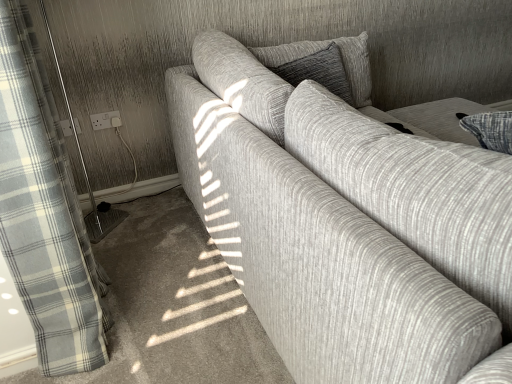
Question: Is textured gray couch at center thinner than white plastic socket at upper left, which appears as the first electric outlet when viewed from the right?

Choices:
 (A) no
 (B) yes

Answer: (A)

Question: Would you consider textured gray couch at center to be distant from white plastic socket at upper left, which appears as the first electric outlet when viewed from the right?

Choices:
 (A) no
 (B) yes

Answer: (B)

Question: Is textured gray couch at center wider than white plastic socket at upper left, which appears as the first electric outlet when viewed from the right?

Choices:
 (A) no
 (B) yes

Answer: (B)

Question: Can you confirm if textured gray couch at center is smaller than white plastic socket at upper left, acting as the second electric outlet starting from the left?

Choices:
 (A) no
 (B) yes

Answer: (A)

Question: From a real-world perspective, is textured gray couch at center located beneath white plastic socket at upper left, acting as the second electric outlet starting from the left?

Choices:
 (A) yes
 (B) no

Answer: (A)

Question: Considering the relative positions of textured gray couch at center and white plastic socket at upper left, acting as the second electric outlet starting from the left, in the image provided, is textured gray couch at center to the right of white plastic socket at upper left, acting as the second electric outlet starting from the left, from the viewer's perspective?

Choices:
 (A) no
 (B) yes

Answer: (B)

Question: From a real-world perspective, is textured gray couch at center positioned over white textured screen door at left based on gravity?

Choices:
 (A) no
 (B) yes

Answer: (A)

Question: Can you confirm if textured gray couch at center is bigger than white textured screen door at left?

Choices:
 (A) yes
 (B) no

Answer: (A)

Question: Is textured gray couch at center oriented away from white textured screen door at left?

Choices:
 (A) no
 (B) yes

Answer: (B)

Question: Considering the relative positions of textured gray couch at center and white textured screen door at left in the image provided, is textured gray couch at center behind white textured screen door at left?

Choices:
 (A) yes
 (B) no

Answer: (B)

Question: Are textured gray couch at center and white textured screen door at left making contact?

Choices:
 (A) yes
 (B) no

Answer: (B)

Question: Is textured gray couch at center facing towards white textured screen door at left?

Choices:
 (A) yes
 (B) no

Answer: (B)

Question: From a real-world perspective, is textured gray couch at center physically below textured gray pillow at center?

Choices:
 (A) yes
 (B) no

Answer: (A)